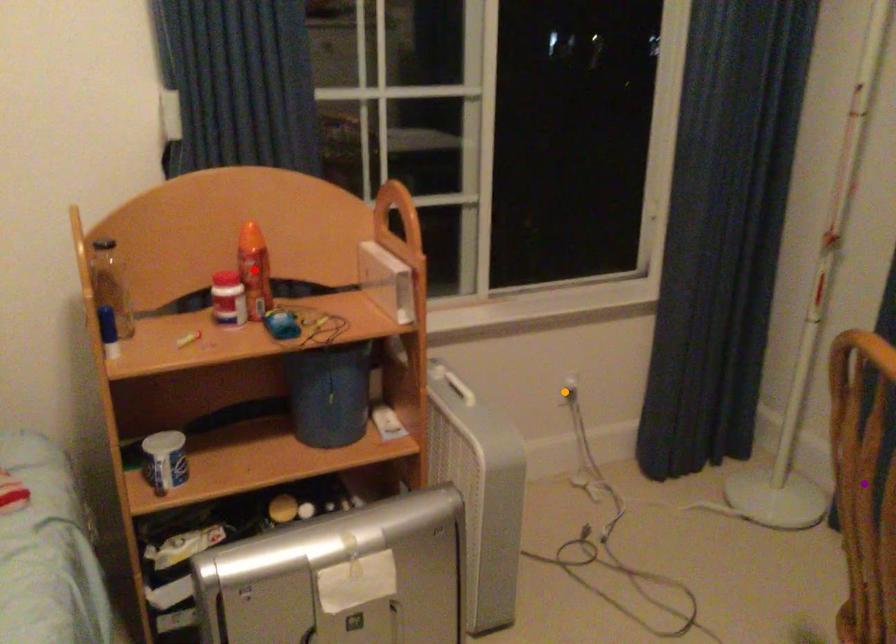
Order these from nearest to farthest:
1. orange point
2. purple point
3. red point

purple point
red point
orange point